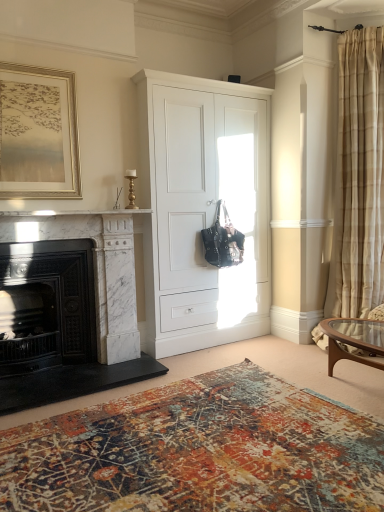
Find the location of a particular element. The width and height of the screenshot is (384, 512). white matte cabinet at center is located at coordinates (201, 210).

The image size is (384, 512). What do you see at coordinates (199, 451) in the screenshot?
I see `textured rug at lower center` at bounding box center [199, 451].

You are a GUI agent. You are given a task and a screenshot of the screen. Output one action in this format:
    pyautogui.click(x=<x>, y=<y>)
    Task: Click on the gold metallic picture frame at upper left
    
    Given the screenshot: What is the action you would take?
    pyautogui.click(x=38, y=134)

Locate an element on the screen. The height and width of the screenshot is (512, 384). white marble fireplace at left, the 1th fireplace viewed from the right is located at coordinates (76, 306).

Can you confirm if white marble fireplace at left is taller than black marble fireplace at left, arranged as the 2th fireplace when viewed from the right?

Incorrect, the height of white marble fireplace at left is not larger of that of black marble fireplace at left, arranged as the 2th fireplace when viewed from the right.

From a real-world perspective, is white marble fireplace at left located higher than black marble fireplace at left, the 1th fireplace viewed from the left?

Yes, from a real-world perspective, white marble fireplace at left is over black marble fireplace at left, the 1th fireplace viewed from the left

From a real-world perspective, count 2nd fireplaces downward from the white marble fireplace at left and point to it. Please provide its 2D coordinates.

[(46, 305)]

Is textured rug at lower center turned away from black marble fireplace at left, the 1th fireplace viewed from the left?

No, textured rug at lower center's orientation is not away from black marble fireplace at left, the 1th fireplace viewed from the left.

Locate an element on the screen. This screenshot has height=512, width=384. hardwood that appears on the right of black marble fireplace at left, the 1th fireplace viewed from the left is located at coordinates (199, 451).

Is textured rug at lower center at the right side of black marble fireplace at left, arranged as the 2th fireplace when viewed from the right?

Yes, textured rug at lower center is to the right of black marble fireplace at left, arranged as the 2th fireplace when viewed from the right.

Is textured rug at lower center placed right next to black marble fireplace at left, arranged as the 2th fireplace when viewed from the right?

They are not placed beside each other.

Is white marble fireplace at left, the 1th fireplace viewed from the right, not close to white matte cabinet at center?

That's not correct — white marble fireplace at left, the 1th fireplace viewed from the right, is a little close to white matte cabinet at center.

Between white marble fireplace at left, the 1th fireplace viewed from the right, and white matte cabinet at center, which one has smaller size?

white marble fireplace at left, the 1th fireplace viewed from the right.

Considering the positions of objects white marble fireplace at left, the 1th fireplace viewed from the right, and white matte cabinet at center in the image provided, who is more to the right, white marble fireplace at left, the 1th fireplace viewed from the right, or white matte cabinet at center?

white matte cabinet at center is more to the right.

Measure the distance from white marble fireplace at left, the 1th fireplace viewed from the right, to white matte cabinet at center.

A distance of 73.30 centimeters exists between white marble fireplace at left, the 1th fireplace viewed from the right, and white matte cabinet at center.

Considering the relative sizes of white marble fireplace at left, the 1th fireplace viewed from the right, and gold metallic picture frame at upper left in the image provided, is white marble fireplace at left, the 1th fireplace viewed from the right, thinner than gold metallic picture frame at upper left?

No.

Considering the positions of objects white marble fireplace at left, the 1th fireplace viewed from the right, and gold metallic picture frame at upper left in the image provided, who is more to the left, white marble fireplace at left, the 1th fireplace viewed from the right, or gold metallic picture frame at upper left?

Positioned to the left is gold metallic picture frame at upper left.

From a real-world perspective, is white marble fireplace at left, the 1th fireplace viewed from the right, beneath gold metallic picture frame at upper left?

Correct, in the physical world, white marble fireplace at left, the 1th fireplace viewed from the right, is lower than gold metallic picture frame at upper left.

Does point (65, 251) lie in front of point (43, 85)?

No, (65, 251) is behind (43, 85).

I want to click on picture frame that is above the black marble fireplace at left, the 1th fireplace viewed from the left (from the image's perspective), so click(x=38, y=134).

Based on their sizes in the image, would you say black marble fireplace at left, the 1th fireplace viewed from the left, is bigger or smaller than gold metallic picture frame at upper left?

In the image, black marble fireplace at left, the 1th fireplace viewed from the left, appears to be larger than gold metallic picture frame at upper left.

How different are the orientations of black marble fireplace at left, the 1th fireplace viewed from the left, and gold metallic picture frame at upper left in degrees?

0.222 degrees separate the facing orientations of black marble fireplace at left, the 1th fireplace viewed from the left, and gold metallic picture frame at upper left.

Is black marble fireplace at left, the 1th fireplace viewed from the left, to the left or to the right of gold metallic picture frame at upper left in the image?

black marble fireplace at left, the 1th fireplace viewed from the left, is to the left of gold metallic picture frame at upper left.

Is gold metallic picture frame at upper left at the right side of textured rug at lower center?

Incorrect, gold metallic picture frame at upper left is not on the right side of textured rug at lower center.

Is gold metallic picture frame at upper left not inside textured rug at lower center?

Indeed, gold metallic picture frame at upper left is completely outside textured rug at lower center.

Which of these two, gold metallic picture frame at upper left or textured rug at lower center, is thinner?

With smaller width is gold metallic picture frame at upper left.

Find the location of `cabinetry on the right of white marble fireplace at left, arranged as the second fireplace when viewed from the left`. cabinetry on the right of white marble fireplace at left, arranged as the second fireplace when viewed from the left is located at coordinates (201, 210).

From a real-world perspective, is white matte cabinet at center positioned under white marble fireplace at left, the 1th fireplace viewed from the right, based on gravity?

Actually, white matte cabinet at center is physically above white marble fireplace at left, the 1th fireplace viewed from the right, in the real world.

Is white matte cabinet at center smaller than white marble fireplace at left, arranged as the second fireplace when viewed from the left?

Incorrect, white matte cabinet at center is not smaller in size than white marble fireplace at left, arranged as the second fireplace when viewed from the left.

Is the surface of white matte cabinet at center in direct contact with white marble fireplace at left, the 1th fireplace viewed from the right?

No, white matte cabinet at center is not next to white marble fireplace at left, the 1th fireplace viewed from the right.

The height and width of the screenshot is (512, 384). Identify the location of mantle to the right of black marble fireplace at left, the 1th fireplace viewed from the left. (73, 213).

You are a GUI agent. You are given a task and a screenshot of the screen. Output one action in this format:
    pyautogui.click(x=<x>, y=<y>)
    Task: Click on the 1st fireplace positioned above the textured rug at lower center (from the image's perspective)
    The image size is (384, 512).
    Given the screenshot: What is the action you would take?
    pyautogui.click(x=46, y=305)

Estimate the real-world distances between objects in this image. Which object is further from white marble fireplace at left, textured rug at lower center or black marble fireplace at left, the 1th fireplace viewed from the left?

Based on the image, textured rug at lower center appears to be further to white marble fireplace at left.

Which object lies nearer to the anchor point beige textured curtain at right, white matte cabinet at center or white marble fireplace at left, the 1th fireplace viewed from the right?

Based on the image, white matte cabinet at center appears to be nearer to beige textured curtain at right.

Looking at the image, which one is located closer to white matte cabinet at center, white marble fireplace at left or black marble fireplace at left, arranged as the 2th fireplace when viewed from the right?

The object closer to white matte cabinet at center is white marble fireplace at left.

Based on their spatial positions, is textured rug at lower center or black marble fireplace at left, arranged as the 2th fireplace when viewed from the right, closer to white marble fireplace at left, the 1th fireplace viewed from the right?

black marble fireplace at left, arranged as the 2th fireplace when viewed from the right, is closer to white marble fireplace at left, the 1th fireplace viewed from the right.

Based on their spatial positions, is textured rug at lower center or white marble fireplace at left, arranged as the second fireplace when viewed from the left, further from beige textured curtain at right?

white marble fireplace at left, arranged as the second fireplace when viewed from the left, lies further to beige textured curtain at right than the other object.

From the image, which object appears to be farther from textured rug at lower center, white marble fireplace at left or beige textured curtain at right?

Based on the image, beige textured curtain at right appears to be further to textured rug at lower center.

From the image, which object appears to be farther from textured rug at lower center, white marble fireplace at left or white marble fireplace at left, the 1th fireplace viewed from the right?

white marble fireplace at left.

When comparing their distances from beige textured curtain at right, does white marble fireplace at left or black marble fireplace at left, the 1th fireplace viewed from the left, seem further?

black marble fireplace at left, the 1th fireplace viewed from the left, is positioned further to the anchor beige textured curtain at right.

This screenshot has height=512, width=384. I want to click on fireplace located between black marble fireplace at left, arranged as the 2th fireplace when viewed from the right, and beige textured curtain at right in the left-right direction, so pos(76,306).

The height and width of the screenshot is (512, 384). I want to click on picture frame positioned between textured rug at lower center and white matte cabinet at center from near to far, so click(38, 134).

Find the location of a particular element. fireplace positioned between textured rug at lower center and black marble fireplace at left, arranged as the 2th fireplace when viewed from the right, from near to far is located at coordinates (76, 306).

Locate an element on the screen. mantle between gold metallic picture frame at upper left and white marble fireplace at left, the 1th fireplace viewed from the right, vertically is located at coordinates (73, 213).